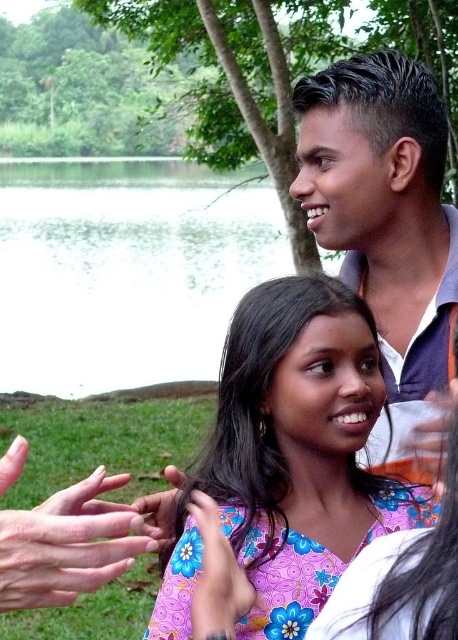
Describe the element at coordinates (387, 224) in the screenshot. The width and height of the screenshot is (458, 640). I see `matte purple shirt at upper right` at that location.

Where is `matte purple shirt at upper right`? matte purple shirt at upper right is located at coordinates (387, 224).

Is point (403, 420) more distant than point (154, 540)?

Yes.

Locate an element on the screen. matte purple shirt at upper right is located at coordinates click(x=387, y=224).

Does green water at center have a greater width compared to floral fabric dress at center?

Indeed, green water at center has a greater width compared to floral fabric dress at center.

Can you confirm if green water at center is smaller than floral fabric dress at center?

Actually, green water at center might be larger than floral fabric dress at center.

Who is more distant from viewer, [186,376] or [285,317]?

Positioned behind is point [186,376].

The image size is (458, 640). I want to click on green water at center, so click(x=125, y=268).

Is floral fabric dress at center wider than smooth skin hand at lower left?

Yes, floral fabric dress at center is wider than smooth skin hand at lower left.

Does floral fabric dress at center have a greater height compared to smooth skin hand at lower left?

Yes.

Where is `floral fabric dress at center`? The image size is (458, 640). floral fabric dress at center is located at coordinates (289, 458).

Identify the location of floral fabric dress at center. (289, 458).